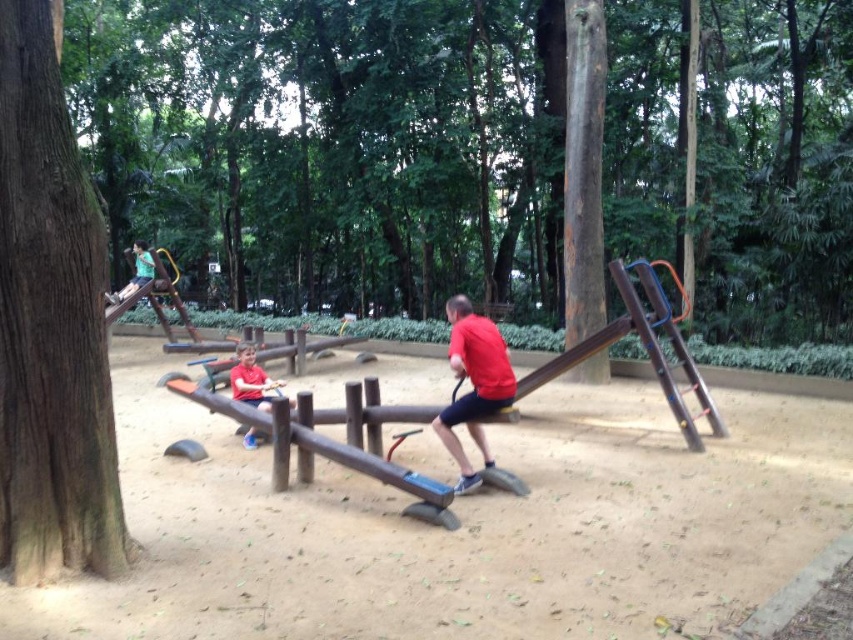
Question: Does red matte shirt at center appear on the right side of matte red shirt at center?

Choices:
 (A) no
 (B) yes

Answer: (B)

Question: Considering the relative positions of red matte shirt at center and matte red shirt at center in the image provided, where is red matte shirt at center located with respect to matte red shirt at center?

Choices:
 (A) left
 (B) right

Answer: (B)

Question: Which point is closer to the camera?

Choices:
 (A) (485, 374)
 (B) (242, 346)

Answer: (A)

Question: Among these objects, which one is farthest from the camera?

Choices:
 (A) red matte shirt at center
 (B) matte red shirt at center

Answer: (B)

Question: Can you confirm if red matte shirt at center is positioned to the right of matte red shirt at center?

Choices:
 (A) yes
 (B) no

Answer: (A)